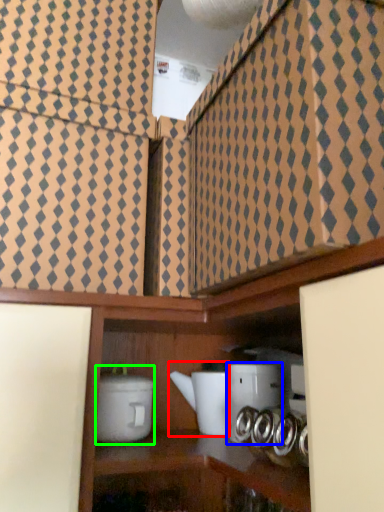
Question: Based on their relative distances, which object is nearer to appliance (highlighted by a red box)? Choose from appliance (highlighted by a blue box) and appliance (highlighted by a green box).

Choices:
 (A) appliance
 (B) appliance

Answer: (A)